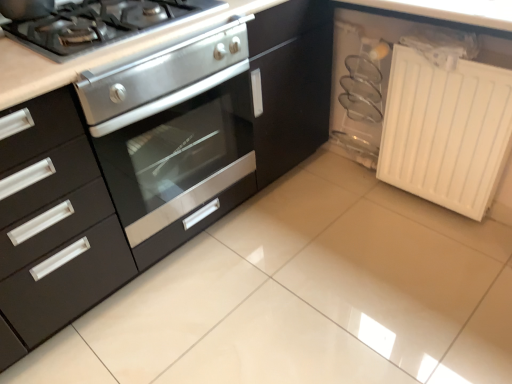
What do you see at coordinates (100, 24) in the screenshot?
I see `stainless steel gas stove at upper left` at bounding box center [100, 24].

Image resolution: width=512 pixels, height=384 pixels. Describe the element at coordinates (174, 138) in the screenshot. I see `stainless steel oven at center` at that location.

Measure the distance between white matte radiator at lower right and camera.

white matte radiator at lower right is 4.27 feet away from camera.

Find the location of `stainless steel gas stove at upper left`. stainless steel gas stove at upper left is located at coordinates (100, 24).

Does stainless steel oven at center turn towards stainless steel gas stove at upper left?

No, stainless steel oven at center is not aimed at stainless steel gas stove at upper left.

Considering the relative sizes of stainless steel oven at center and stainless steel gas stove at upper left in the image provided, is stainless steel oven at center shorter than stainless steel gas stove at upper left?

No, stainless steel oven at center is not shorter than stainless steel gas stove at upper left.

Locate an element on the screen. This screenshot has width=512, height=384. gas stove behind the stainless steel oven at center is located at coordinates (100, 24).

Is point (230, 177) positioned in front of point (110, 7)?

That is False.

In the scene shown: Is stainless steel gas stove at upper left not within stainless steel oven at center?

Yes.

From the picture: Is there a large distance between stainless steel gas stove at upper left and stainless steel oven at center?

No, stainless steel gas stove at upper left is not far from stainless steel oven at center.

Between stainless steel gas stove at upper left and stainless steel oven at center, which one has larger size?

With larger size is stainless steel oven at center.

Is stainless steel gas stove at upper left at the back of white matte radiator at lower right?

No, white matte radiator at lower right is not facing away from stainless steel gas stove at upper left.

Image resolution: width=512 pixels, height=384 pixels. Find the location of `gas stove in front of the white matte radiator at lower right`. gas stove in front of the white matte radiator at lower right is located at coordinates (100, 24).

Which is in front, point (446, 136) or point (49, 13)?

Point (49, 13)

From the image's perspective, is white matte radiator at lower right over stainless steel gas stove at upper left?

No.

Is white matte radiator at lower right outside of stainless steel oven at center?

Yes, white matte radiator at lower right is not within stainless steel oven at center.

Which of these two, white matte radiator at lower right or stainless steel oven at center, is thinner?

Thinner between the two is white matte radiator at lower right.

From a real-world perspective, relative to stainless steel oven at center, is white matte radiator at lower right vertically above or below?

From a real-world perspective, white matte radiator at lower right is physically below stainless steel oven at center.

Does point (448, 109) come farther from viewer compared to point (159, 180)?

That is True.

Is stainless steel oven at center facing away from white matte radiator at lower right?

No, stainless steel oven at center is not facing the opposite direction of white matte radiator at lower right.

Which object is wider, stainless steel oven at center or white matte radiator at lower right?

stainless steel oven at center is wider.

Is white matte radiator at lower right surrounded by stainless steel oven at center?

No, white matte radiator at lower right is not a part of stainless steel oven at center.

This screenshot has height=384, width=512. What are the coordinates of `gas stove on the left of white matte radiator at lower right` in the screenshot? It's located at (100, 24).

Can white matte radiator at lower right be found inside stainless steel gas stove at upper left?

No, white matte radiator at lower right is located outside of stainless steel gas stove at upper left.

Based on the photo, from the image's perspective, is stainless steel gas stove at upper left under white matte radiator at lower right?

No.

From a real-world perspective, which is physically above, stainless steel gas stove at upper left or white matte radiator at lower right?

From a 3D spatial view, stainless steel gas stove at upper left is above.

The width and height of the screenshot is (512, 384). Identify the location of gas stove on the left of stainless steel oven at center. (100, 24).

You are a GUI agent. You are given a task and a screenshot of the screen. Output one action in this format:
    pyautogui.click(x=<x>, y=<y>)
    Task: Click on the oven in front of the stainless steel gas stove at upper left
    
    Given the screenshot: What is the action you would take?
    pyautogui.click(x=174, y=138)

Based on their spatial positions, is stainless steel gas stove at upper left or white matte radiator at lower right further from stainless steel oven at center?

Among the two, white matte radiator at lower right is located further to stainless steel oven at center.

Which object lies nearer to the anchor point stainless steel oven at center, white matte radiator at lower right or stainless steel gas stove at upper left?

Among the two, stainless steel gas stove at upper left is located nearer to stainless steel oven at center.

Estimate the real-world distances between objects in this image. Which object is further from stainless steel gas stove at upper left, white matte radiator at lower right or stainless steel oven at center?

white matte radiator at lower right lies further to stainless steel gas stove at upper left than the other object.

When comparing their distances from white matte radiator at lower right, does stainless steel oven at center or stainless steel gas stove at upper left seem closer?

Based on the image, stainless steel oven at center appears to be nearer to white matte radiator at lower right.

Based on their spatial positions, is stainless steel gas stove at upper left or stainless steel oven at center closer to white matte radiator at lower right?

stainless steel oven at center.

Based on their spatial positions, is stainless steel oven at center or white matte radiator at lower right closer to stainless steel gas stove at upper left?

stainless steel oven at center is closer to stainless steel gas stove at upper left.

Where is `oven situated between stainless steel gas stove at upper left and white matte radiator at lower right from left to right`? oven situated between stainless steel gas stove at upper left and white matte radiator at lower right from left to right is located at coordinates (174, 138).